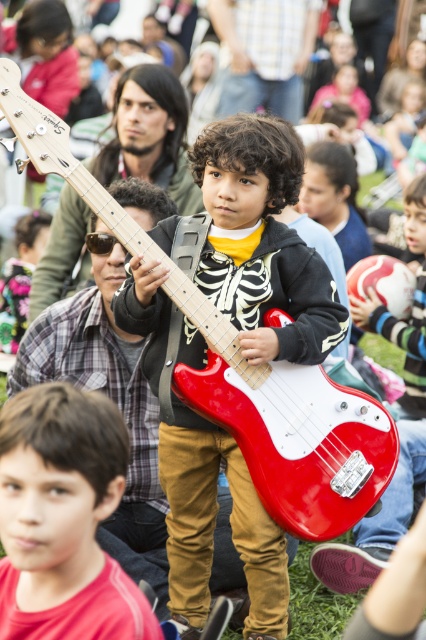
Question: Considering the real-world distances, which object is closest to the glossy red guitar at center?

Choices:
 (A) matte red guitar at center
 (B) matte wood guitar at center
 (C) matte black guitar at center

Answer: (C)

Question: Can you confirm if matte black guitar at center is smaller than glossy red guitar at center?

Choices:
 (A) yes
 (B) no

Answer: (A)

Question: Which of these objects is positioned farthest from the matte black guitar at center?

Choices:
 (A) matte wood guitar at center
 (B) glossy red electric guitar at center
 (C) glossy red guitar at center
 (D) matte red guitar at center

Answer: (A)

Question: Can you confirm if glossy red electric guitar at center is positioned below matte wood guitar at center?

Choices:
 (A) no
 (B) yes

Answer: (B)

Question: From the image, what is the correct spatial relationship of glossy red electric guitar at center in relation to matte red guitar at center?

Choices:
 (A) left
 (B) right

Answer: (B)

Question: Which object is closer to the camera taking this photo?

Choices:
 (A) glossy red electric guitar at center
 (B) matte black guitar at center
 (C) matte wood guitar at center

Answer: (A)